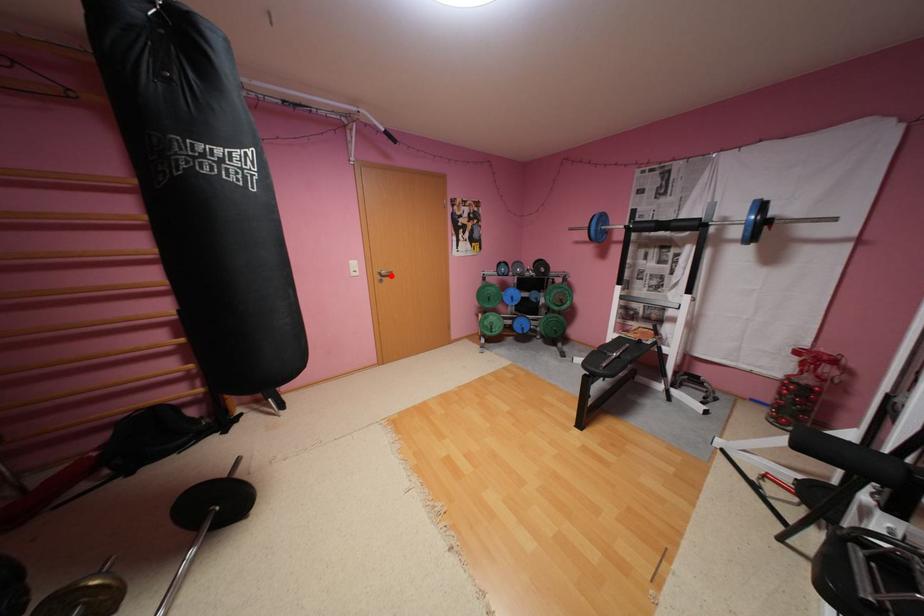
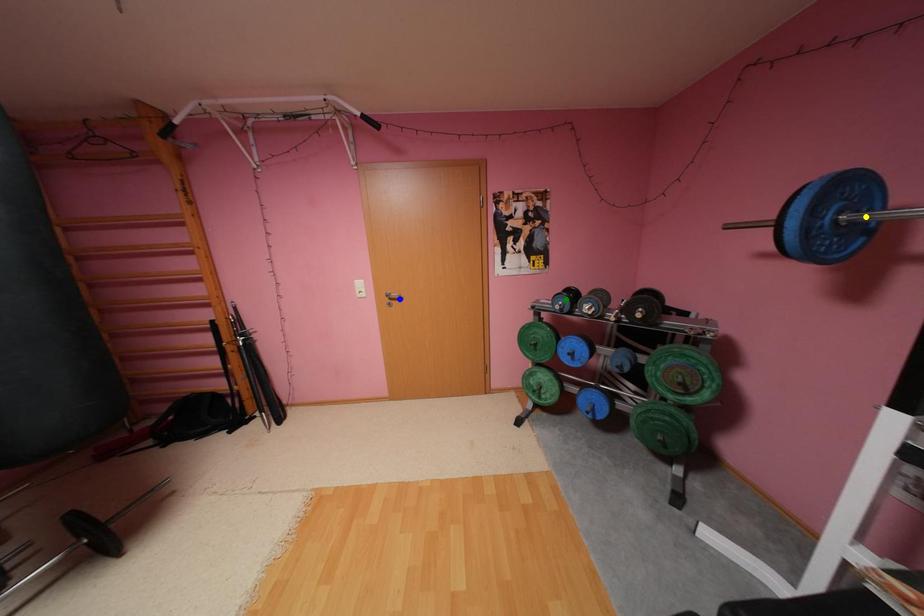
Question: I am providing you with two images of the same scene from different viewpoints. A red point is marked on the first image. You are given multiple points on the second image. Which spot in image 2 lines up with the point in image 1?

Choices:
 (A) green point
 (B) blue point
 (C) yellow point

Answer: (B)